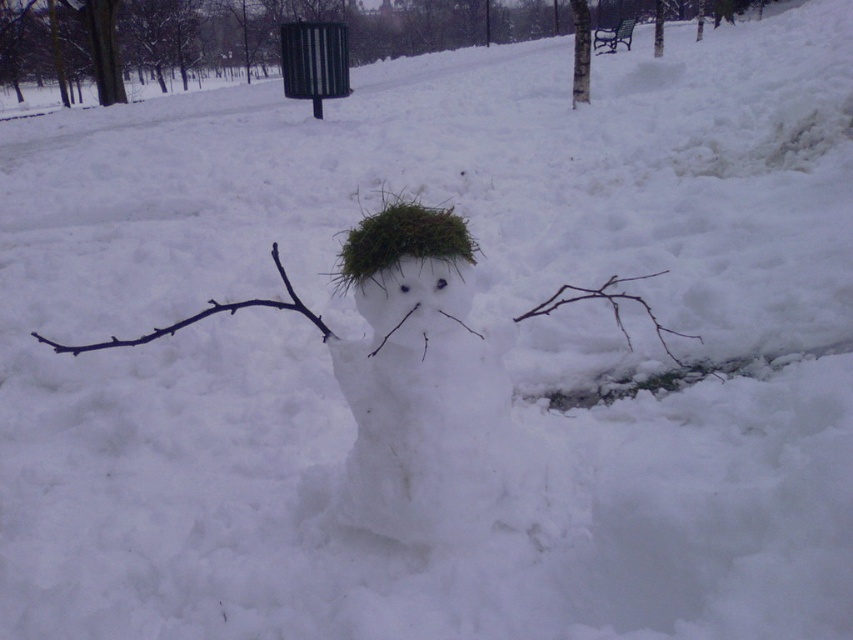
Question: Estimate the real-world distances between objects in this image. Which object is farther from the brown twig at lower right?

Choices:
 (A) white fluffy snowman at center
 (B) brown/rough branch at left

Answer: (B)

Question: Is white fluffy snowman at center further to the viewer compared to brown twig at lower right?

Choices:
 (A) no
 (B) yes

Answer: (A)

Question: Is brown/rough branch at left positioned at the back of brown twig at lower right?

Choices:
 (A) yes
 (B) no

Answer: (B)

Question: Is the position of brown/rough branch at left less distant than that of brown twig at lower right?

Choices:
 (A) yes
 (B) no

Answer: (A)

Question: Which object appears farthest from the camera in this image?

Choices:
 (A) brown twig at lower right
 (B) brown/rough branch at left

Answer: (A)

Question: Which of the following is the farthest from the observer?

Choices:
 (A) white fluffy snowman at center
 (B) brown/rough branch at left
 (C) brown twig at lower right

Answer: (C)